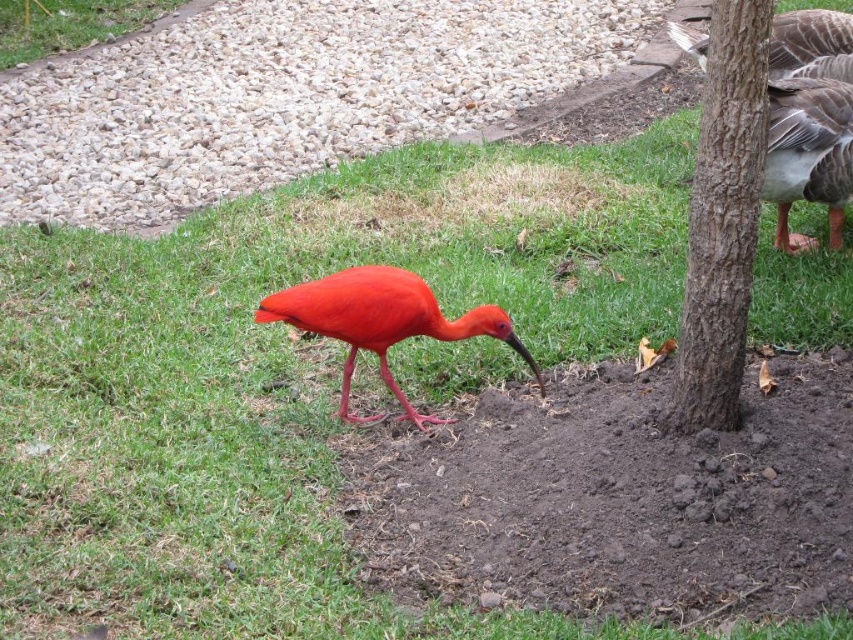
You are a gardener trying to plant a new flower bed. You need to decide between using the brown rough bark at right or the green grass at upper left as mulch. Which area is more suitable for mulching, and why?

The green grass at upper left is more suitable for mulching because it is positioned to the left of the brown rough bark at right, making it easier to access from that side.

You are a birdwatcher trying to locate the brown rough bark at right in the image. Based on the coordinates provided, where exactly would you find it?

The brown rough bark at right is located at the coordinates point (722, 221).

You are a photographer trying to capture both the gray feathered goose at right and the matte red ibis at center in a single shot. Based on their positions, which bird would appear higher in the photo?

The gray feathered goose at right appears higher in the photo because it is positioned above the matte red ibis at center.